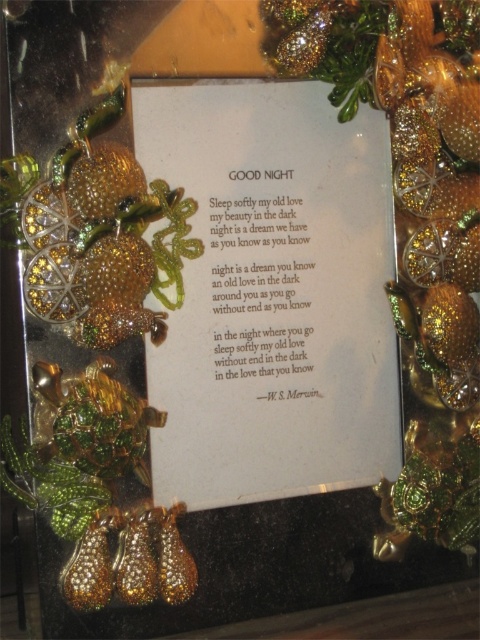
Looking at the framed poem, you notice the white paper at center and the shiny gold ornament at left. Which object has a greater width?

The white paper at center has a greater width than the shiny gold ornament at left.

You are an interior designer arranging decorations on a mantel. You have the gold glitter ornament at center and the shiny gold ornament at left. According to the scene, which ornament is placed higher up?

The gold glitter ornament at center is positioned over the shiny gold ornament at left, so it is placed higher up.

You are an art curator examining the framed poem. You notice two ornaments, the gold glitter ornament at center and the shiny gold ornament at left. Which ornament appears closer to you in the frame?

The gold glitter ornament at center appears closer to you because it is positioned further to the viewer than the shiny gold ornament at left.